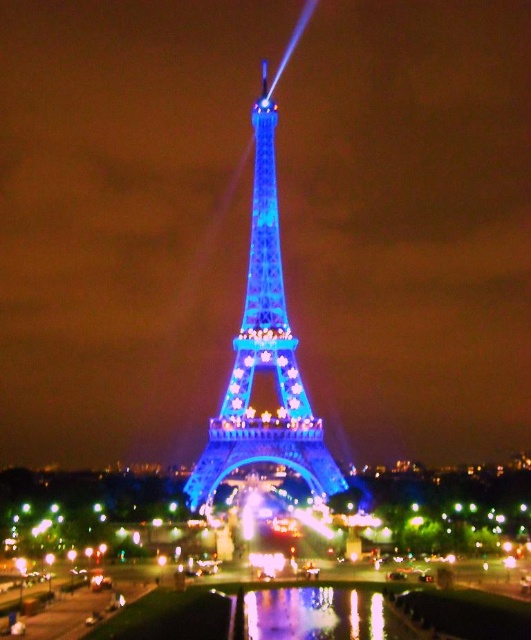
Which is above, blue glass bridge at center or blue illuminated metal eiffel tower at center?

Positioned higher is blue illuminated metal eiffel tower at center.

Is blue glass bridge at center smaller than blue illuminated metal eiffel tower at center?

Correct, blue glass bridge at center occupies less space than blue illuminated metal eiffel tower at center.

Locate an element on the screen. This screenshot has width=531, height=640. blue glass bridge at center is located at coordinates (444, 508).